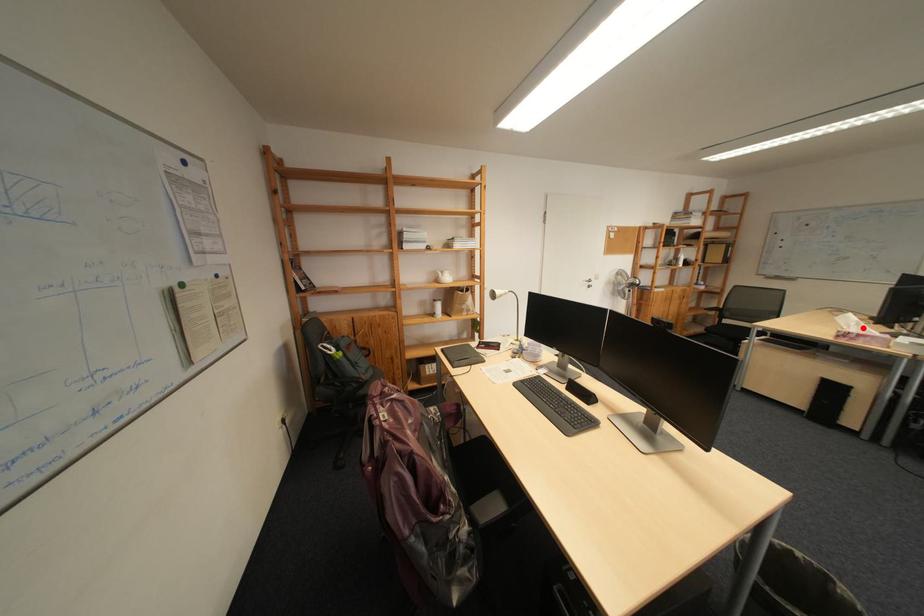
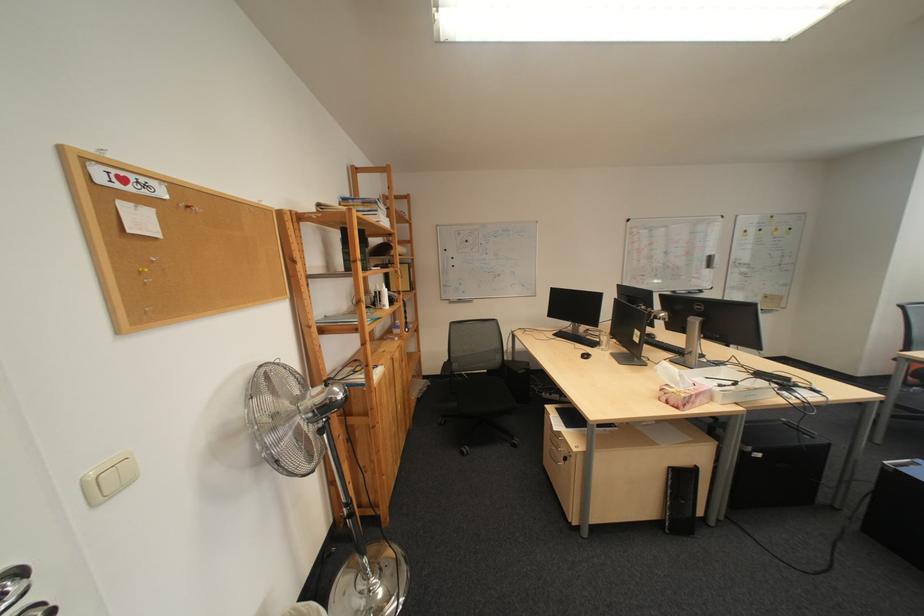
Find the pixel in the second image that matches the highlighted location in the first image.

(690, 385)